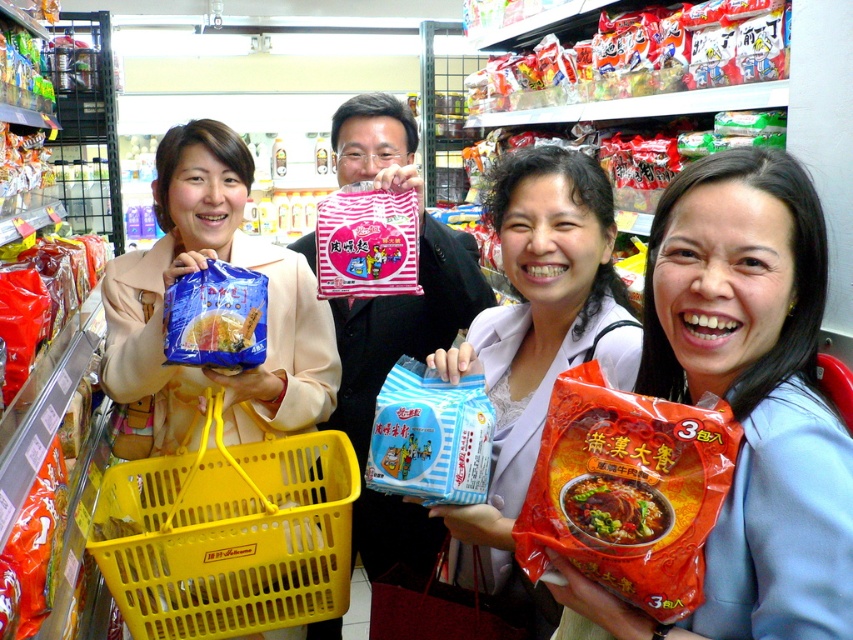
Between point (805, 368) and point (601, 531), which one is positioned in front?

Point (601, 531)

Does matte orange snack bag at center have a greater height compared to red glossy instant noodles at center?

Indeed, matte orange snack bag at center has a greater height compared to red glossy instant noodles at center.

The width and height of the screenshot is (853, 640). Find the location of `matte orange snack bag at center`. matte orange snack bag at center is located at coordinates (755, 388).

Where is `matte orange snack bag at center`? The image size is (853, 640). matte orange snack bag at center is located at coordinates (755, 388).

Is yellow plastic shopping basket at lower left thinner than blue matte bag of noodles at center?

In fact, yellow plastic shopping basket at lower left might be wider than blue matte bag of noodles at center.

Does yellow plastic shopping basket at lower left have a lesser height compared to blue matte bag of noodles at center?

No.

Locate an element on the screen. yellow plastic shopping basket at lower left is located at coordinates (228, 532).

Between point (213, 552) and point (647, 536), which one is positioned in front?

Point (647, 536) is in front.

Where is `yellow plastic shopping basket at lower left`? yellow plastic shopping basket at lower left is located at coordinates (228, 532).